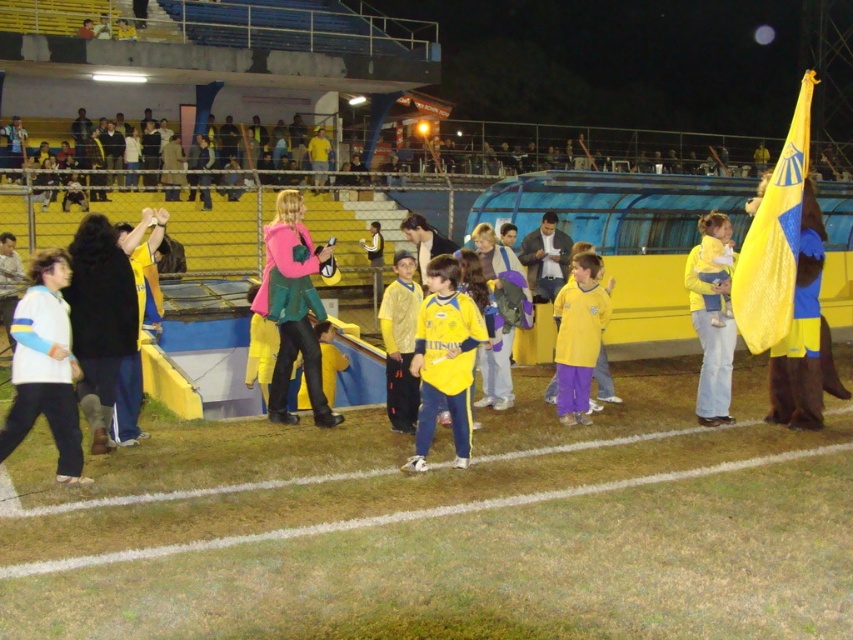
Does white fleece jacket at lower left appear over yellow jersey at center?

Yes.

Between white fleece jacket at lower left and yellow jersey at center, which one is positioned higher?

white fleece jacket at lower left is above.

Describe the element at coordinates (45, 365) in the screenshot. The height and width of the screenshot is (640, 853). I see `white fleece jacket at lower left` at that location.

The image size is (853, 640). In order to click on white fleece jacket at lower left in this screenshot , I will do pyautogui.click(x=45, y=365).

Is pink fabric jacket at center below yellow fabric flag at right?

No.

Which is below, pink fabric jacket at center or yellow fabric flag at right?

yellow fabric flag at right is lower down.

Locate an element on the screen. The image size is (853, 640). pink fabric jacket at center is located at coordinates (292, 307).

Is white fleece jacket at lower left thinner than yellow fabric flag at right?

Incorrect, white fleece jacket at lower left's width is not less than yellow fabric flag at right's.

Between point (22, 358) and point (708, 264), which one is positioned in front?

Positioned in front is point (22, 358).

Locate an element on the screen. This screenshot has height=640, width=853. white fleece jacket at lower left is located at coordinates [x=45, y=365].